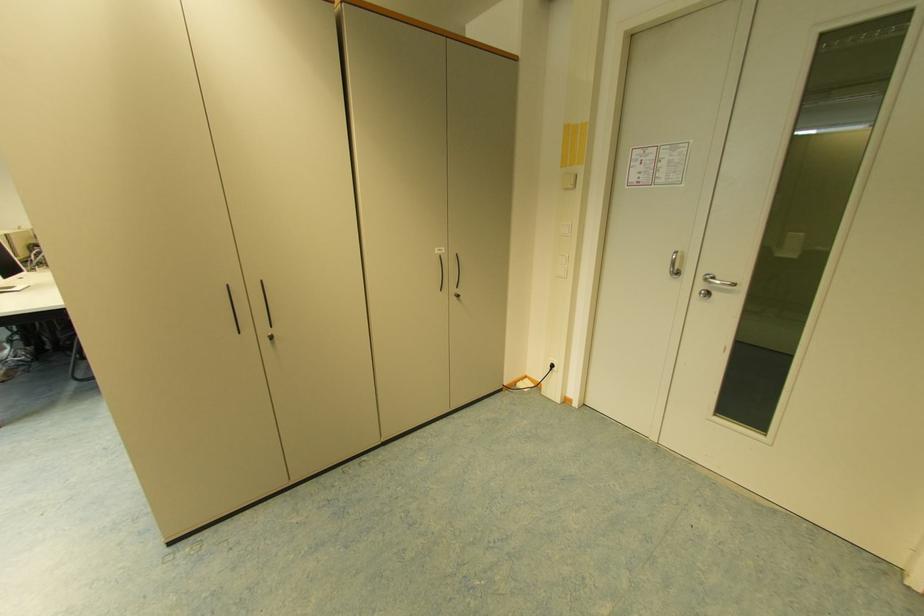
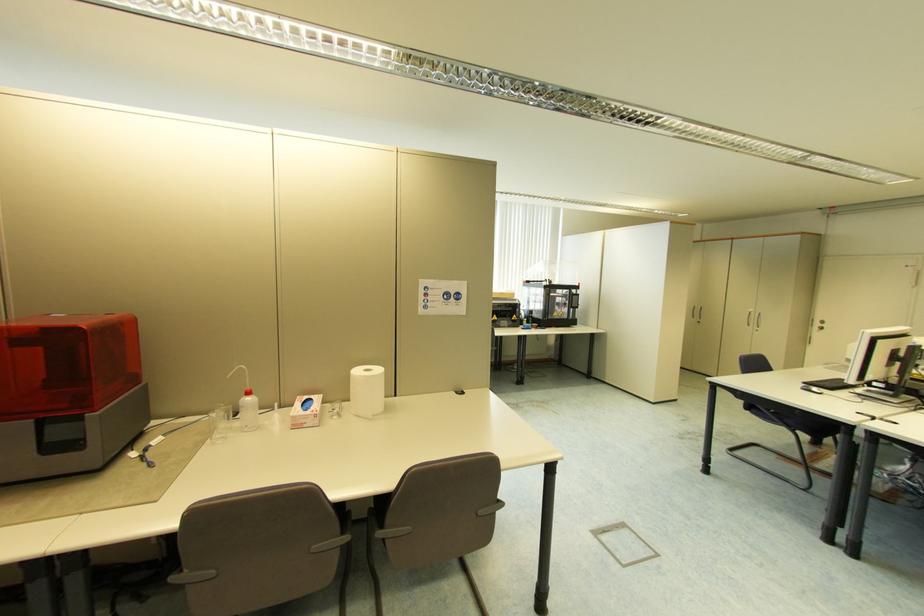
Question: The camera is either moving clockwise (left) or counter-clockwise (right) around the object. The first image is from the beginning of the video and the second image is from the end. Is the camera moving left or right when shooting the video?

Choices:
 (A) Left
 (B) Right

Answer: (B)